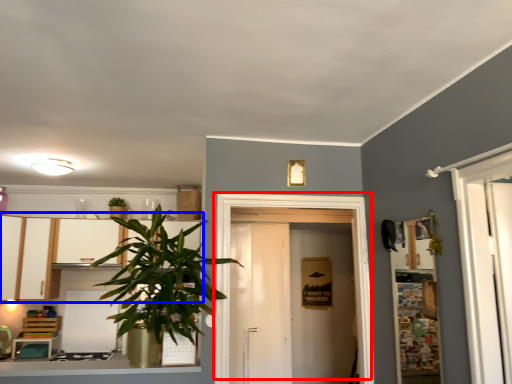
Question: Which object is closer to the camera taking this photo, door (highlighted by a red box) or dresser (highlighted by a blue box)?

Choices:
 (A) door
 (B) dresser

Answer: (B)